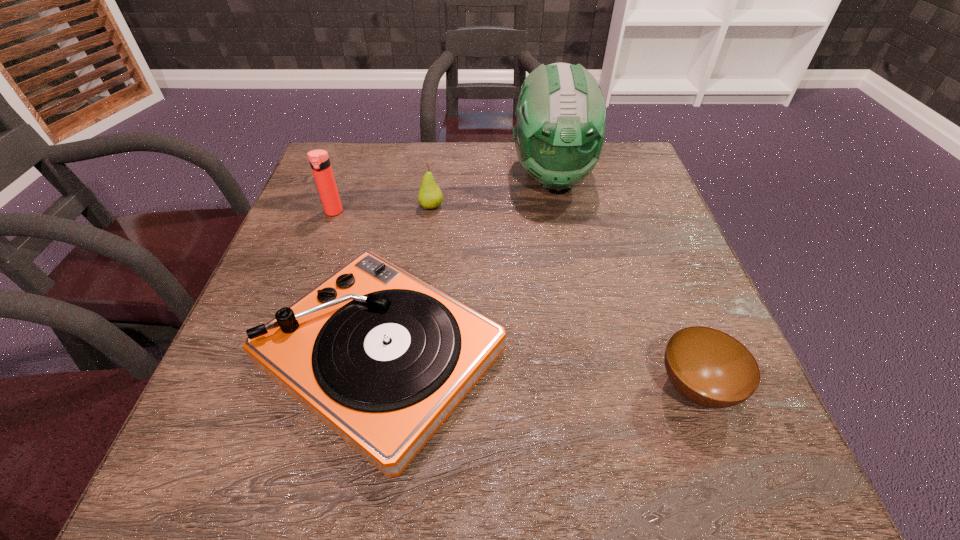
Locate an element on the screen. football helmet is located at coordinates (559, 135).

At what (x,y) coordinates should I click in order to perform the action: click on thermos bottle. Please return your answer as a coordinate pair (x, y). Image resolution: width=960 pixels, height=540 pixels. Looking at the image, I should click on (319, 160).

The width and height of the screenshot is (960, 540). Find the location of `pear`. pear is located at coordinates (430, 196).

At what (x,y) coordinates should I click in order to perform the action: click on the second shortest object. Please return your answer as a coordinate pair (x, y). This screenshot has width=960, height=540. Looking at the image, I should click on (382, 358).

In order to click on bowl in this screenshot , I will do `click(708, 367)`.

Where is `free location located on the visor of the tallest object`? This screenshot has width=960, height=540. free location located on the visor of the tallest object is located at coordinates (566, 248).

Identify the location of free space located 0.070m on the front of the thermos bottle. (324, 239).

At what (x,y) coordinates should I click in order to perform the action: click on free point located 0.200m on the back of the pear. Please return your answer as a coordinate pair (x, y). The height and width of the screenshot is (540, 960). Looking at the image, I should click on (438, 156).

Image resolution: width=960 pixels, height=540 pixels. I want to click on blank space located 0.200m on the right of the record player, so 621,356.

Identify the location of vacant area located on the back of the bowl. The width and height of the screenshot is (960, 540). (674, 330).